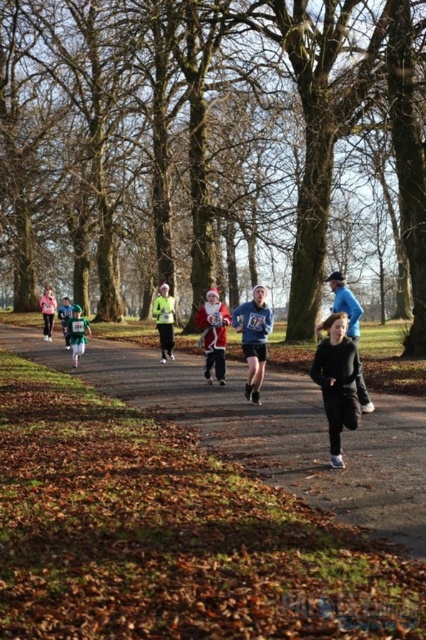
Does brown textured tree at center have a greater height compared to reflective yellow jacket at center?

Yes, brown textured tree at center is taller than reflective yellow jacket at center.

Where is `brown textured tree at center`? brown textured tree at center is located at coordinates (210, 150).

Does point (163, 20) come in front of point (252, 305)?

No, (163, 20) is behind (252, 305).

Is point (365, 227) positioned behind point (256, 326)?

Yes, it is behind point (256, 326).

Does point (51, 35) come in front of point (244, 385)?

No.

Where is `brown textured tree at center`? The height and width of the screenshot is (640, 426). brown textured tree at center is located at coordinates (210, 150).

Which is behind, point (161, 323) or point (69, 326)?

Positioned behind is point (69, 326).

Is reflective yellow jacket at center closer to camera compared to green matte jacket at center?

No, it is not.

Who is more distant from viewer, (161, 307) or (71, 344)?

The point (71, 344) is behind.

Find the location of a particular element. This screenshot has width=426, height=640. reflective yellow jacket at center is located at coordinates (164, 321).